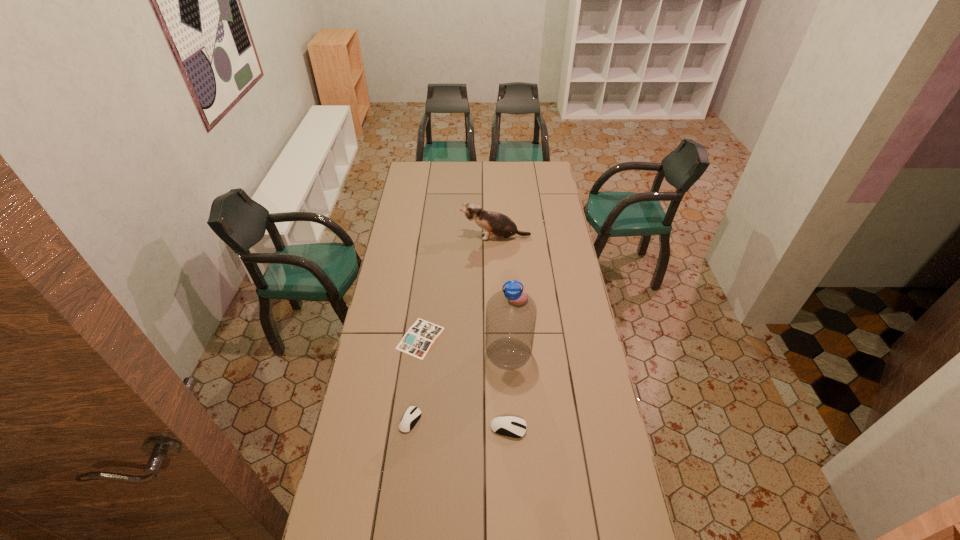
Please point a spot to add another mouse on the right. Please provide its 2D coordinates. Your answer should be formatted as a tuple, i.e. [(x, y)], where the tuple contains the x and y coordinates of a point satisfying the conditions above.

[(610, 436)]